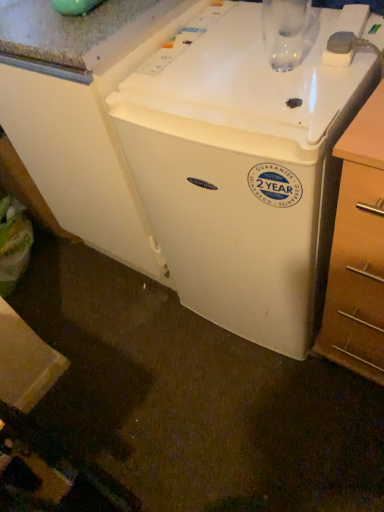
In order to face wooden at right, should I rotate leftwards or rightwards?

Turn right approximately 26.076 degrees to face it.

Locate an element on the screen. wooden at right is located at coordinates (356, 275).

The width and height of the screenshot is (384, 512). What do you see at coordinates (356, 275) in the screenshot?
I see `wooden at right` at bounding box center [356, 275].

Describe the element at coordinates (193, 147) in the screenshot. I see `white plastic refrigerator at center` at that location.

This screenshot has height=512, width=384. I want to click on white plastic refrigerator at center, so click(x=193, y=147).

Locate an element on the screen. wooden at right is located at coordinates (356, 275).

Which is more to the left, white plastic refrigerator at center or wooden at right?

white plastic refrigerator at center.

Based on the photo, does white plastic refrigerator at center lie in front of wooden at right?

No, the depth of white plastic refrigerator at center is greater than that of wooden at right.

Which is closer, (223, 267) or (341, 282)?

Point (223, 267).

From the image's perspective, is white plastic refrigerator at center above or below wooden at right?

Based on their image positions, white plastic refrigerator at center is located above wooden at right.

From a real-world perspective, is white plastic refrigerator at center positioned above or below wooden at right?

white plastic refrigerator at center is above wooden at right.

From the picture: Which object is wider, white plastic refrigerator at center or wooden at right?

Wider between the two is white plastic refrigerator at center.

Is white plastic refrigerator at center shorter than wooden at right?

No, white plastic refrigerator at center is not shorter than wooden at right.

Considering the sizes of objects white plastic refrigerator at center and wooden at right in the image provided, who is smaller, white plastic refrigerator at center or wooden at right?

Smaller between the two is wooden at right.

Is white plastic refrigerator at center situated inside wooden at right or outside?

white plastic refrigerator at center is outside wooden at right.

Is white plastic refrigerator at center directly adjacent to wooden at right?

No, white plastic refrigerator at center is not making contact with wooden at right.

Could you tell me if white plastic refrigerator at center is facing wooden at right?

No, white plastic refrigerator at center is not oriented towards wooden at right.

How much distance is there between white plastic refrigerator at center and wooden at right?

white plastic refrigerator at center and wooden at right are 13.63 inches apart.

In order to click on drawer below the white plastic refrigerator at center (from the image's perspective) in this screenshot , I will do `click(356, 275)`.

Based on the photo, which is more to the right, wooden at right or white plastic refrigerator at center?

From the viewer's perspective, wooden at right appears more on the right side.

Which object is closer to the camera taking this photo, wooden at right or white plastic refrigerator at center?

Positioned in front is wooden at right.

Is point (331, 272) positioned behind point (309, 148)?

Yes, it is.

From the image's perspective, is wooden at right above or below white plastic refrigerator at center?

Based on their image positions, wooden at right is located beneath white plastic refrigerator at center.

From a real-world perspective, which object rests below the other?

wooden at right, from a real-world perspective.

In terms of width, does wooden at right look wider or thinner when compared to white plastic refrigerator at center?

Clearly, wooden at right has less width compared to white plastic refrigerator at center.

In terms of height, does wooden at right look taller or shorter compared to white plastic refrigerator at center?

In the image, wooden at right appears to be shorter than white plastic refrigerator at center.

Looking at the image, does wooden at right seem bigger or smaller compared to white plastic refrigerator at center?

In the image, wooden at right appears to be smaller than white plastic refrigerator at center.

Is wooden at right inside or outside of white plastic refrigerator at center?

The correct answer is: outside.

Is wooden at right far away from white plastic refrigerator at center?

No.

Could you tell me if wooden at right is facing white plastic refrigerator at center?

No, wooden at right is not aimed at white plastic refrigerator at center.

Where is `home appliance that is above the wooden at right (from a real-world perspective)`? The image size is (384, 512). home appliance that is above the wooden at right (from a real-world perspective) is located at coordinates (193, 147).

Where is `drawer in front of the white plastic refrigerator at center`? Image resolution: width=384 pixels, height=512 pixels. drawer in front of the white plastic refrigerator at center is located at coordinates (356, 275).

The width and height of the screenshot is (384, 512). What are the coordinates of `home appliance above the wooden at right (from a real-world perspective)` in the screenshot? It's located at (193, 147).